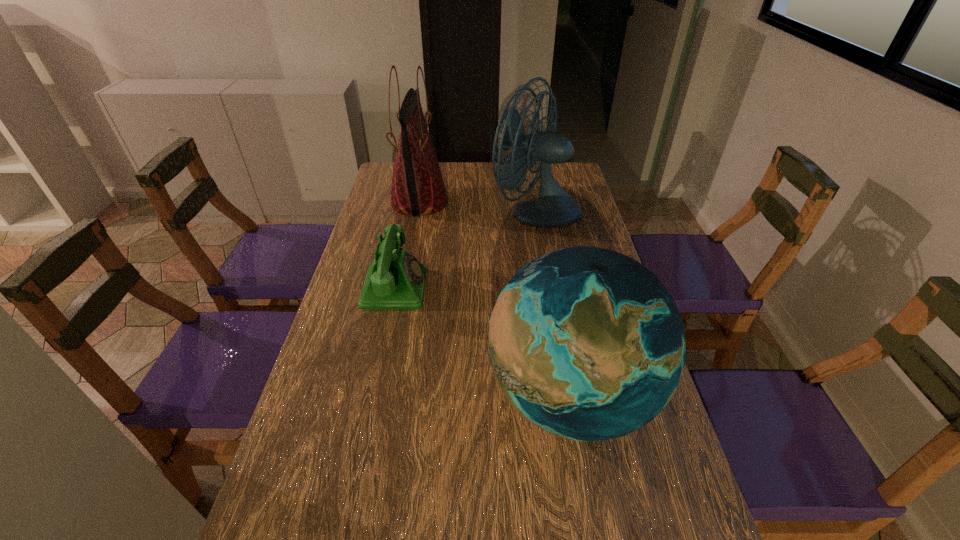
The height and width of the screenshot is (540, 960). In order to click on handbag in this screenshot , I will do `click(418, 188)`.

At what (x,y) coordinates should I click in order to perform the action: click on fan. Please return your answer as a coordinate pair (x, y). This screenshot has height=540, width=960. Looking at the image, I should click on (554, 207).

Identify the location of globe. The width and height of the screenshot is (960, 540). (586, 343).

Identify the location of the third tallest object. The width and height of the screenshot is (960, 540). 586,343.

Identify the location of the second nearest object. (395, 280).

The width and height of the screenshot is (960, 540). What are the coordinates of `the shortest object` in the screenshot? It's located at (x=395, y=280).

Identify the location of free space located 0.110m on the right of the handbag. This screenshot has width=960, height=540. (477, 201).

Locate an element on the screen. Image resolution: width=960 pixels, height=540 pixels. free space located in front of the fan to blow air is located at coordinates (432, 211).

In order to click on free space located in front of the fan to blow air in this screenshot , I will do `click(468, 211)`.

Locate an element on the screen. This screenshot has width=960, height=540. vacant space located 0.350m in front of the fan to blow air is located at coordinates (394, 211).